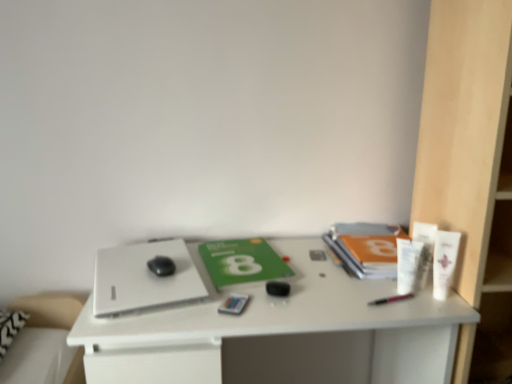
Question: Considering the relative positions of white matte desk at center and matte plastic card at center, marked as the second stationery in a right-to-left arrangement, in the image provided, is white matte desk at center behind matte plastic card at center, marked as the second stationery in a right-to-left arrangement,?

Choices:
 (A) yes
 (B) no

Answer: (B)

Question: Can you confirm if white matte desk at center is thinner than matte plastic card at center, which appears as the first stationery when viewed from the left?

Choices:
 (A) yes
 (B) no

Answer: (B)

Question: From the image's perspective, is white matte desk at center over matte plastic card at center, marked as the second stationery in a right-to-left arrangement?

Choices:
 (A) yes
 (B) no

Answer: (B)

Question: From a real-world perspective, is white matte desk at center below matte plastic card at center, marked as the second stationery in a right-to-left arrangement?

Choices:
 (A) no
 (B) yes

Answer: (B)

Question: Can you confirm if white matte desk at center is positioned to the left of matte plastic card at center, marked as the second stationery in a right-to-left arrangement?

Choices:
 (A) no
 (B) yes

Answer: (A)

Question: From the image's perspective, relative to matte plastic card at center, marked as the second stationery in a right-to-left arrangement, is white plastic tube at right, the second toiletry in the left-to-right sequence, above or below?

Choices:
 (A) below
 (B) above

Answer: (B)

Question: Which is correct: white plastic tube at right, the second toiletry in the left-to-right sequence, is inside matte plastic card at center, marked as the second stationery in a right-to-left arrangement, or outside of it?

Choices:
 (A) inside
 (B) outside

Answer: (B)

Question: Considering the positions of point (424, 223) and point (230, 296), is point (424, 223) closer or farther from the camera than point (230, 296)?

Choices:
 (A) farther
 (B) closer

Answer: (A)

Question: In the image, is white plastic tube at right, which is the 2th toiletry in right-to-left order, on the left side or the right side of matte plastic card at center, marked as the second stationery in a right-to-left arrangement?

Choices:
 (A) right
 (B) left

Answer: (A)

Question: Based on their sizes in the image, would you say white plastic bookshelf at right is bigger or smaller than white plastic tube at right, the first toiletry from the left?

Choices:
 (A) big
 (B) small

Answer: (A)

Question: Visually, is white plastic bookshelf at right positioned to the left or to the right of white plastic tube at right, the first toiletry from the left?

Choices:
 (A) left
 (B) right

Answer: (B)

Question: From the image's perspective, is white plastic bookshelf at right above or below white plastic tube at right, the third toiletry positioned from the right?

Choices:
 (A) below
 (B) above

Answer: (B)

Question: Looking at their shapes, would you say white plastic bookshelf at right is wider or thinner than white plastic tube at right, the third toiletry positioned from the right?

Choices:
 (A) wide
 (B) thin

Answer: (A)

Question: From a real-world perspective, is white plastic tube at right, the second toiletry in the left-to-right sequence, physically located above or below white matte tube at upper right, which is the 3th toiletry from left to right?

Choices:
 (A) above
 (B) below

Answer: (B)

Question: Is point (417, 289) positioned closer to the camera than point (450, 281)?

Choices:
 (A) closer
 (B) farther

Answer: (B)